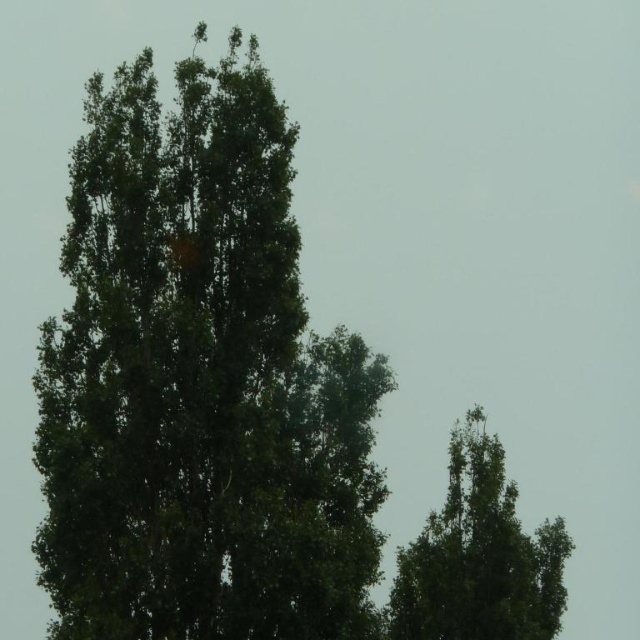
Question: Can you confirm if green leafy tree at center is positioned to the right of green leafy tree at upper right?

Choices:
 (A) no
 (B) yes

Answer: (A)

Question: Is green leafy tree at center wider than green leafy tree at upper right?

Choices:
 (A) yes
 (B) no

Answer: (A)

Question: Which point is farther to the camera?

Choices:
 (A) (353, 355)
 (B) (458, 593)

Answer: (B)

Question: Which object is farther from the camera taking this photo?

Choices:
 (A) green leafy tree at center
 (B) green leafy tree at upper right

Answer: (B)

Question: Is green leafy tree at center bigger than green leafy tree at upper right?

Choices:
 (A) yes
 (B) no

Answer: (A)